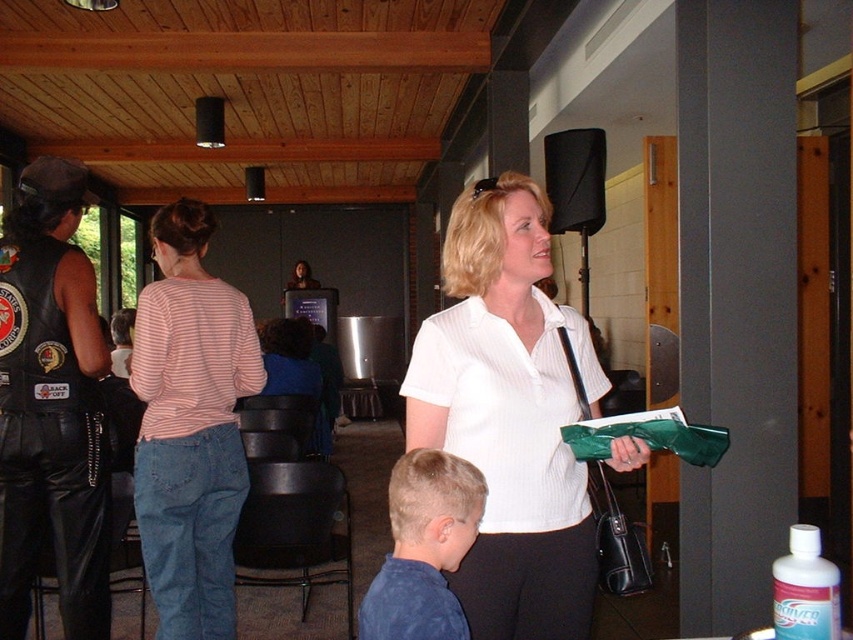
Can you confirm if pink striped shirt at center is shorter than white pinstriped shirt at center?

No.

Is pink striped shirt at center in front of white pinstriped shirt at center?

No, it is behind white pinstriped shirt at center.

The image size is (853, 640). I want to click on pink striped shirt at center, so click(x=190, y=426).

Identify the location of pink striped shirt at center. Image resolution: width=853 pixels, height=640 pixels. (190, 426).

Which of these two, white ribbed shirt at center or green plastic clipboard at center, stands shorter?

Standing shorter between the two is green plastic clipboard at center.

Between point (560, 424) and point (604, 422), which one is positioned in front?

Point (604, 422)

Who is more forward, [535,244] or [677,435]?

Point [677,435] is in front.

Where is `white ribbed shirt at center`? white ribbed shirt at center is located at coordinates (509, 413).

Does white ribbed shirt at center have a lesser height compared to pink striped shirt at center?

Correct, white ribbed shirt at center is not as tall as pink striped shirt at center.

Is point (532, 388) behind point (233, 465)?

That is False.

You are a GUI agent. You are given a task and a screenshot of the screen. Output one action in this format:
    pyautogui.click(x=<x>, y=<y>)
    Task: Click on the white ribbed shirt at center
    This screenshot has height=640, width=853.
    Given the screenshot: What is the action you would take?
    pyautogui.click(x=509, y=413)